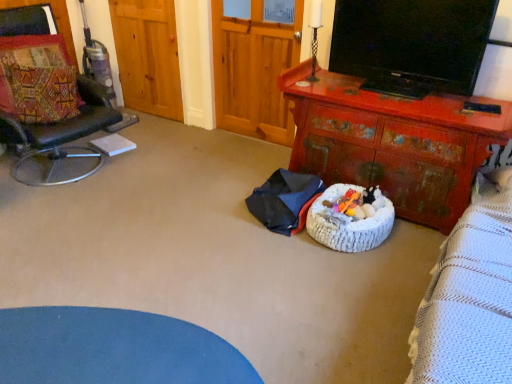
Question: In terms of width, does rusty wood desk at center look wider or thinner when compared to wooden armoire at center?

Choices:
 (A) wide
 (B) thin

Answer: (A)

Question: Is rusty wood desk at center bigger or smaller than wooden armoire at center?

Choices:
 (A) big
 (B) small

Answer: (A)

Question: Which is farther from the rusty wood desk at center?

Choices:
 (A) leather cushioned chair at left
 (B) wooden armoire at center
 (C) patchwork fabric pillow at left
 (D) white knitted infant bed at center
 (E) black glossy tv at upper right

Answer: (C)

Question: Which object is the closest to the black glossy tv at upper right?

Choices:
 (A) rusty wood desk at center
 (B) white knitted infant bed at center
 (C) plush multicolored toy at center
 (D) wooden armoire at center
 (E) patchwork fabric pillow at left

Answer: (A)